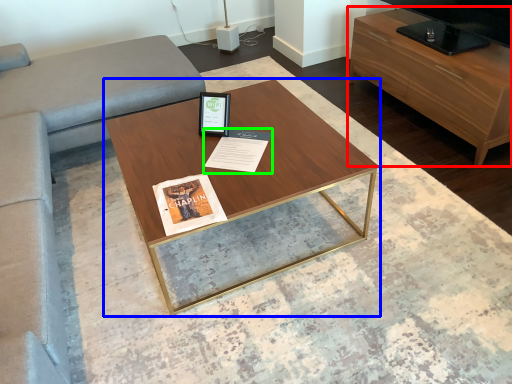
Question: Considering the real-world distances, which object is closest to table (highlighted by a red box)? coffee table (highlighted by a blue box) or magazine (highlighted by a green box).

Choices:
 (A) coffee table
 (B) magazine

Answer: (A)